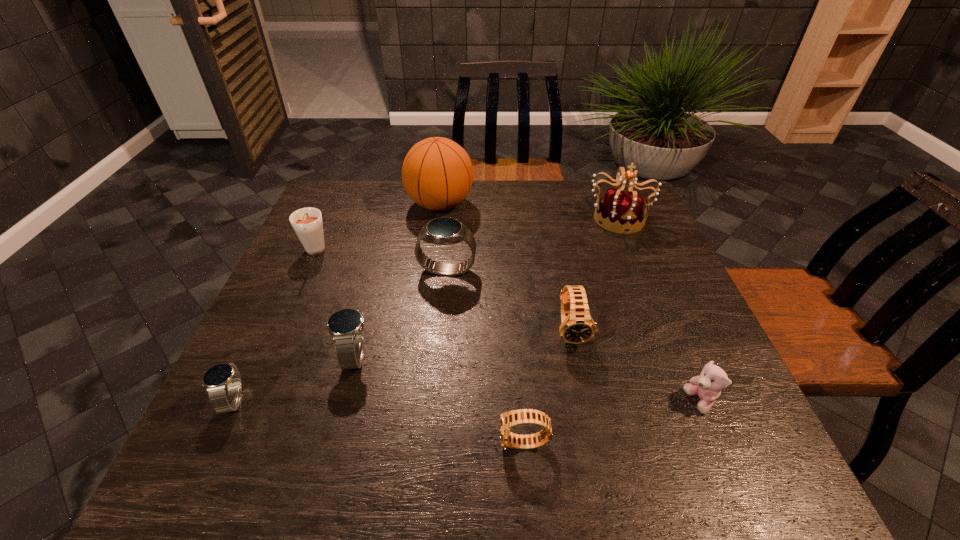
This screenshot has width=960, height=540. I want to click on vacant area situated on the back of the second biggest blue watch, so click(387, 235).

Identify the location of vacant region located 0.290m at the face of the pink teddy bear. (537, 402).

At what (x,y) coordinates should I click in order to perform the action: click on vacant space located at the face of the pink teddy bear. Please return your answer as a coordinate pair (x, y). This screenshot has width=960, height=540. Looking at the image, I should click on (558, 402).

The image size is (960, 540). In order to click on vacant region located at the face of the pink teddy bear in this screenshot , I will do `click(573, 402)`.

Find the location of a particular element. vacant space situated 0.090m on the face of the left black watch is located at coordinates click(x=450, y=444).

Where is `free space located on the face of the left black watch`? free space located on the face of the left black watch is located at coordinates (461, 444).

The height and width of the screenshot is (540, 960). Find the location of `vacant space situated 0.180m on the face of the left black watch`. vacant space situated 0.180m on the face of the left black watch is located at coordinates (400, 444).

Identify the location of free space located on the front of the leftmost watch. The width and height of the screenshot is (960, 540). (206, 458).

I want to click on basketball that is at the far edge, so click(437, 173).

I want to click on tiara that is at the far edge, so click(622, 211).